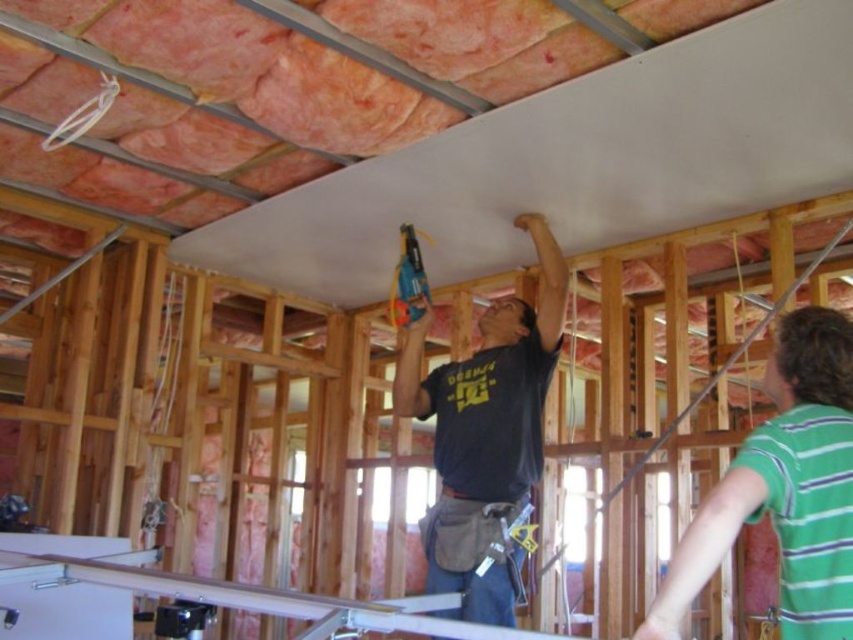
Which of these two, green striped shirt at upper right or dark gray shirt at upper center, stands shorter?

green striped shirt at upper right is shorter.

Is green striped shirt at upper right below dark gray shirt at upper center?

Yes, green striped shirt at upper right is below dark gray shirt at upper center.

Which is in front, point (828, 352) or point (447, 513)?

Point (828, 352)

The width and height of the screenshot is (853, 640). What are the coordinates of `green striped shirt at upper right` in the screenshot? It's located at (784, 490).

Does dark gray shirt at upper center have a larger size compared to blue plastic drill at center?

Correct, dark gray shirt at upper center is larger in size than blue plastic drill at center.

Which is behind, point (525, 314) or point (413, 276)?

Positioned behind is point (525, 314).

Locate an element on the screen. The width and height of the screenshot is (853, 640). dark gray shirt at upper center is located at coordinates (485, 432).

Can you confirm if green striped shirt at upper right is positioned to the left of blue plastic drill at center?

Incorrect, green striped shirt at upper right is not on the left side of blue plastic drill at center.

Who is positioned more to the left, green striped shirt at upper right or blue plastic drill at center?

Positioned to the left is blue plastic drill at center.

Is point (677, 548) closer to camera compared to point (405, 292)?

Yes, it is in front of point (405, 292).

You are a GUI agent. You are given a task and a screenshot of the screen. Output one action in this format:
    pyautogui.click(x=<x>, y=<y>)
    Task: Click on the green striped shirt at upper right
    The width and height of the screenshot is (853, 640).
    Given the screenshot: What is the action you would take?
    pyautogui.click(x=784, y=490)